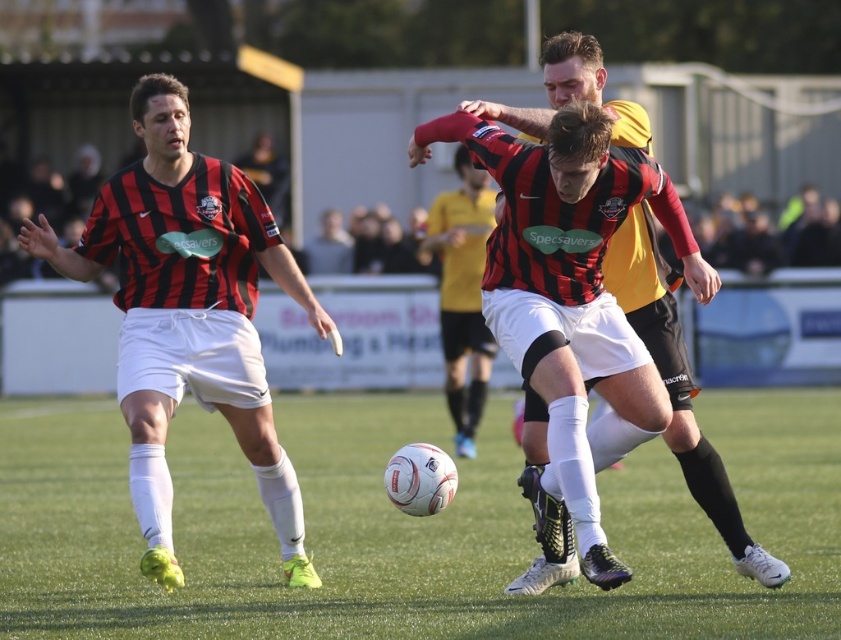
Question: Is matte black soccer ball at center bigger than matte black jersey at center?

Choices:
 (A) no
 (B) yes

Answer: (A)

Question: Which of the following is the closest to the observer?

Choices:
 (A) matte black jersey at left
 (B) matte black soccer ball at center

Answer: (B)

Question: In this image, where is matte black soccer ball at center located relative to matte black jersey at center?

Choices:
 (A) below
 (B) above

Answer: (A)

Question: Among these points, which one is farthest from the camera?

Choices:
 (A) (141, 396)
 (B) (443, 243)
 (C) (558, 38)

Answer: (B)

Question: Is matte black jersey at left positioned behind matte black soccer ball at center?

Choices:
 (A) yes
 (B) no

Answer: (A)

Question: Which point appears closest to the camera in this image?

Choices:
 (A) (467, 310)
 (B) (151, 161)

Answer: (B)